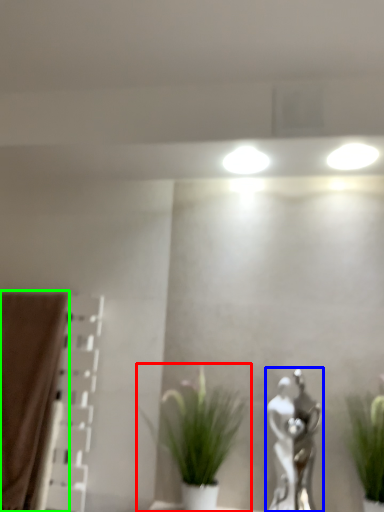
Question: Which object is the farthest from houseplant (highlighted by a red box)? Choose among these: art (highlighted by a blue box) or curtain (highlighted by a green box).

Choices:
 (A) art
 (B) curtain

Answer: (B)